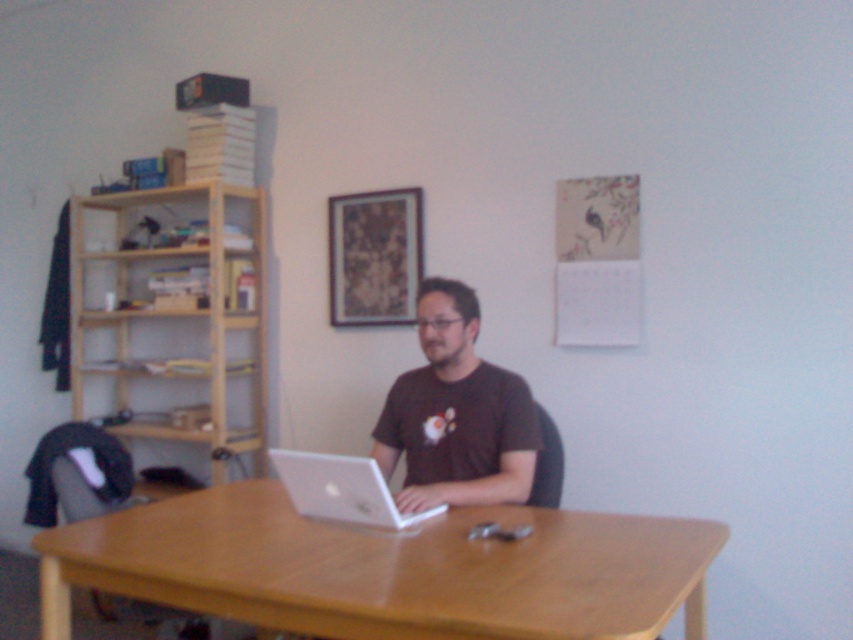
Question: Observing the image, what is the correct spatial positioning of light wood bookshelf at left in reference to brown cotton shirt at center?

Choices:
 (A) right
 (B) left

Answer: (B)

Question: Which of the following is the farthest from the observer?

Choices:
 (A) silver metallic laptop at center
 (B) light brown wood table at center
 (C) light wood bookshelf at left
 (D) brown cotton shirt at center

Answer: (C)

Question: Does light wood bookshelf at left have a greater width compared to silver metallic laptop at center?

Choices:
 (A) yes
 (B) no

Answer: (A)

Question: Can you confirm if light brown wood table at center is wider than light wood bookshelf at left?

Choices:
 (A) no
 (B) yes

Answer: (B)

Question: Which object is closer to the camera taking this photo?

Choices:
 (A) silver metallic laptop at center
 (B) light wood bookshelf at left

Answer: (A)

Question: Which is nearer to the light brown wood table at center?

Choices:
 (A) silver metallic laptop at center
 (B) brown cotton shirt at center

Answer: (A)